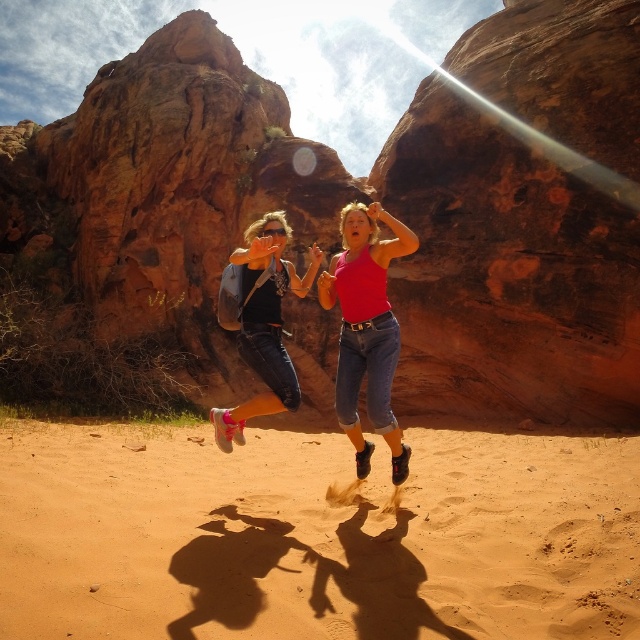
Is rustic sandstone rock formation at center to the right of sandy yellow sand at center from the viewer's perspective?

No, rustic sandstone rock formation at center is not to the right of sandy yellow sand at center.

Can you confirm if rustic sandstone rock formation at center is positioned below sandy yellow sand at center?

No.

Where is `rustic sandstone rock formation at center`? The image size is (640, 640). rustic sandstone rock formation at center is located at coordinates (358, 198).

Between sandy yellow sand at center and matte pink tank top at center, which one appears on the left side from the viewer's perspective?

sandy yellow sand at center is more to the left.

Between point (500, 444) and point (385, 353), which one is positioned in front?

Point (385, 353) is in front.

Who is more forward, (513, 525) or (374, 330)?

Point (513, 525) is in front.

Find the location of `sandy yellow sand at center`. sandy yellow sand at center is located at coordinates (314, 536).

Does point (67, 332) come closer to viewer compared to point (268, 336)?

No, it is not.

Which is in front, point (118, 205) or point (218, 410)?

Point (218, 410) is in front.

Is point (97, 132) behind point (269, 396)?

Yes, point (97, 132) is farther from viewer.

Where is `rustic sandstone rock formation at center`? rustic sandstone rock formation at center is located at coordinates (358, 198).